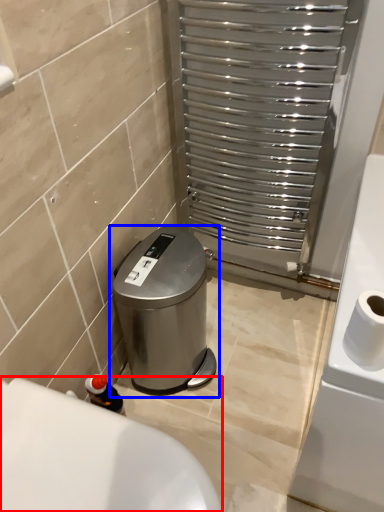
Question: Which object appears farthest to the camera in this image, bath (highlighted by a red box) or waste container (highlighted by a blue box)?

Choices:
 (A) bath
 (B) waste container

Answer: (B)